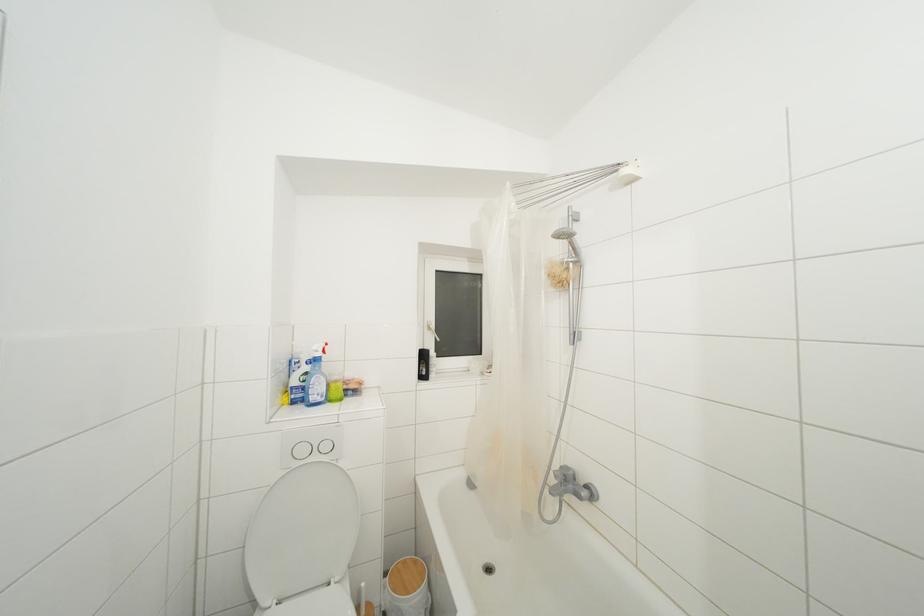
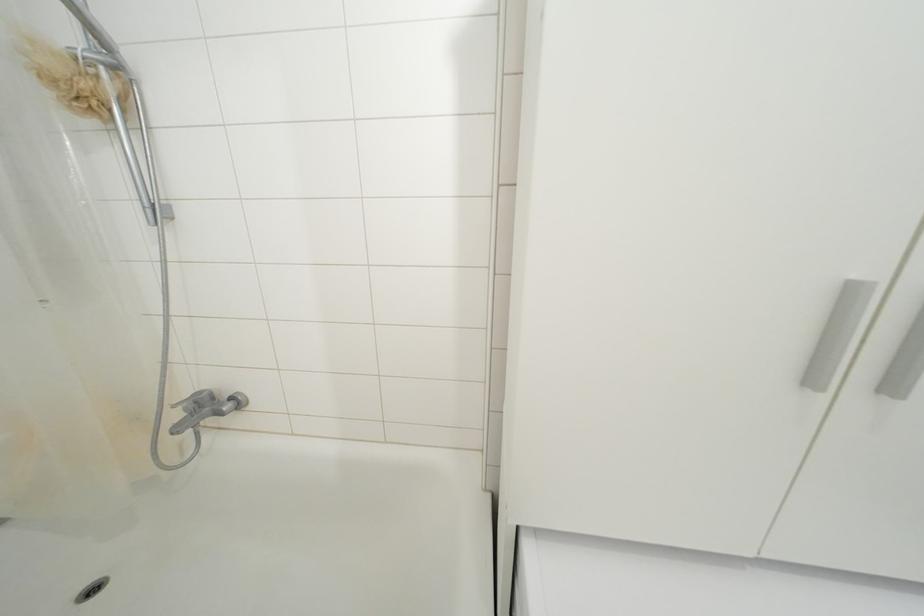
Locate, in the second image, the point that corresponds to pixel 572 273 in the first image.

(100, 79)